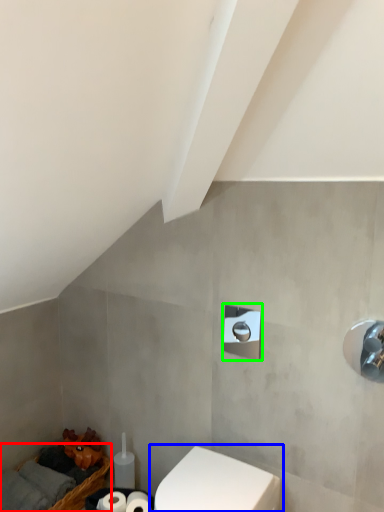
Question: Which is nearer to the basket (highlighted by a red box)? toilet (highlighted by a blue box) or shower (highlighted by a green box).

Choices:
 (A) toilet
 (B) shower

Answer: (A)